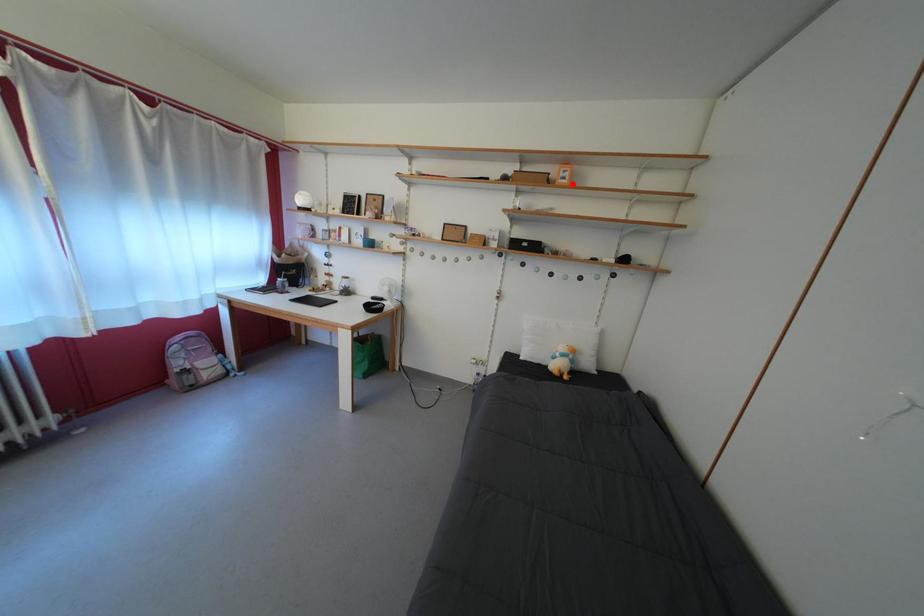
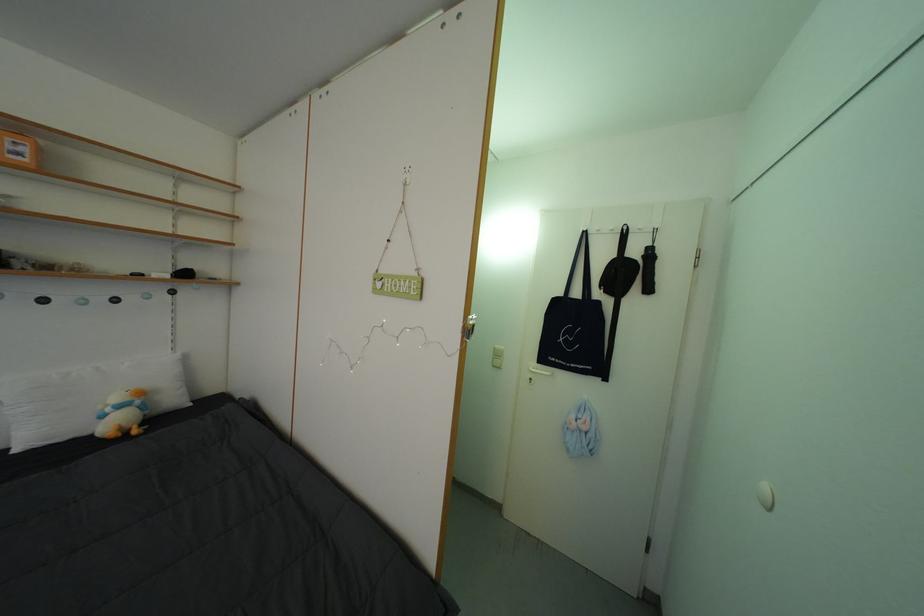
In the second image, find the point that corresponds to the highlighted location in the first image.

(27, 160)